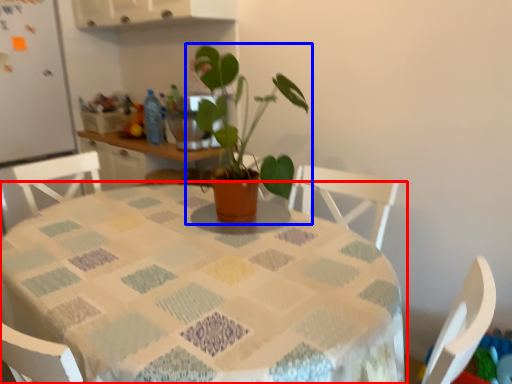
Question: Which object appears farthest to the camera in this image, table (highlighted by a red box) or houseplant (highlighted by a blue box)?

Choices:
 (A) table
 (B) houseplant

Answer: (B)